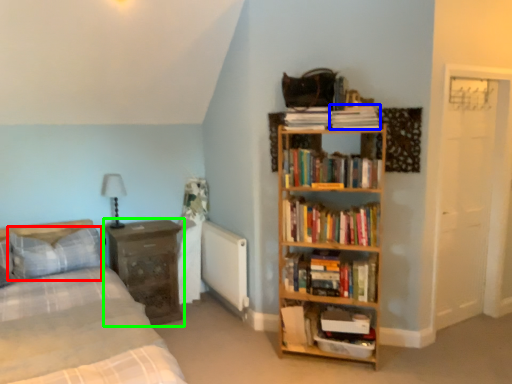
Question: Which object is the closest to the pillow (highlighted by a red box)? Choose among these: paperback book (highlighted by a blue box) or nightstand (highlighted by a green box).

Choices:
 (A) paperback book
 (B) nightstand

Answer: (B)